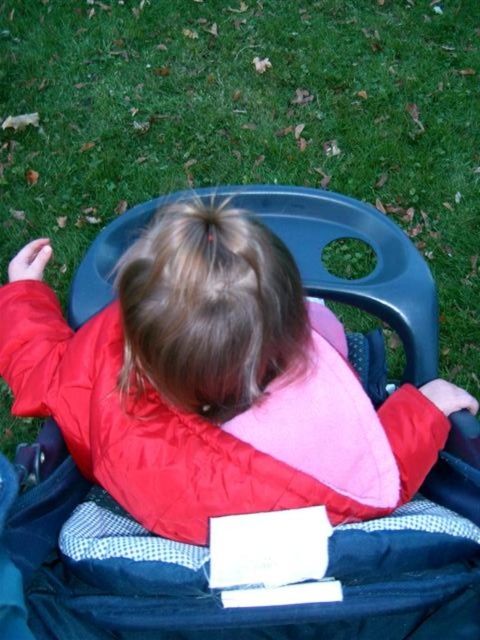
Question: Where is green grass at center located in relation to matte black stroller at center in the image?

Choices:
 (A) above
 (B) below

Answer: (A)

Question: From the image, what is the correct spatial relationship of green grass at center in relation to matte black stroller at center?

Choices:
 (A) below
 (B) above

Answer: (B)

Question: Where is green grass at center located in relation to matte black stroller at center in the image?

Choices:
 (A) right
 (B) left

Answer: (A)